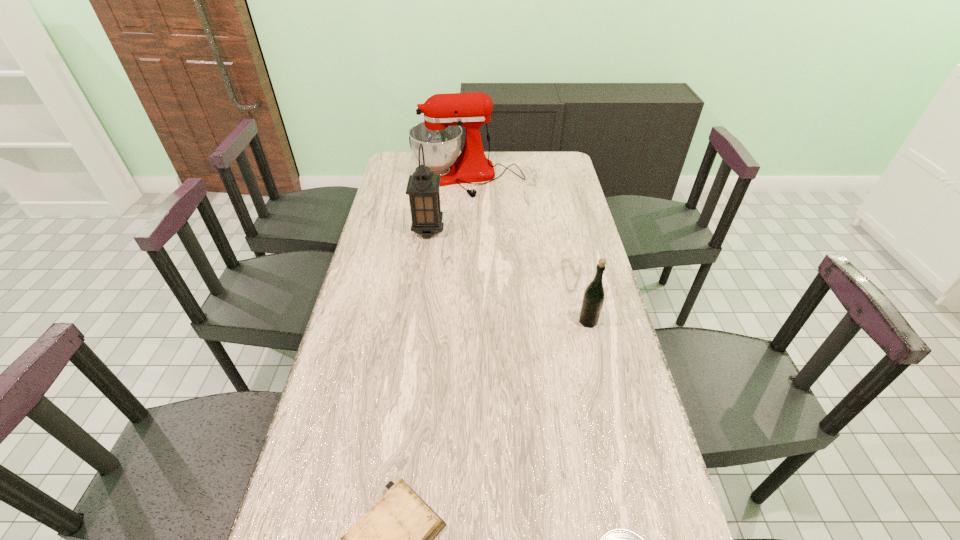
At what (x,y) coordinates should I click in order to perform the action: click on object that is positioned at the right edge. Please return your answer as a coordinate pair (x, y). This screenshot has width=960, height=540. Looking at the image, I should click on (593, 298).

Identify the location of object present at the far left corner. This screenshot has height=540, width=960. (440, 133).

The image size is (960, 540). I want to click on vacant position at the far edge of the desktop, so click(x=497, y=174).

At what (x,y) coordinates should I click in order to perform the action: click on vacant space at the left edge of the desktop. Please return your answer as a coordinate pair (x, y). The image size is (960, 540). Looking at the image, I should click on (291, 529).

Image resolution: width=960 pixels, height=540 pixels. What are the coordinates of `vacant region at the right edge of the desktop` in the screenshot? It's located at (600, 393).

I want to click on vacant space that is in between the third shortest object and the fourth nearest object, so pyautogui.click(x=508, y=276).

The width and height of the screenshot is (960, 540). In order to click on vacant point located between the third tallest object and the lantern in this screenshot , I will do `click(508, 276)`.

Identify the location of vacant area that lies between the lantern and the beer bottle. This screenshot has height=540, width=960. (508, 276).

Where is `free space between the second farthest object and the third farthest object`? free space between the second farthest object and the third farthest object is located at coordinates (508, 276).

Point out which object is positioned as the second nearest to the shortest object. Please provide its 2D coordinates. Your answer should be formatted as a tuple, i.e. [(x, y)], where the tuple contains the x and y coordinates of a point satisfying the conditions above.

[(593, 298)]